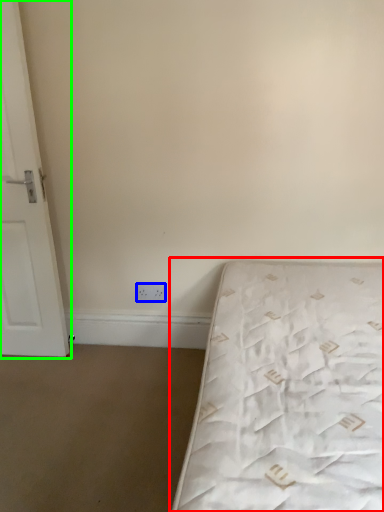
Question: Which is nearer to the bed (highlighted by a red box)? electric outlet (highlighted by a blue box) or door (highlighted by a green box).

Choices:
 (A) electric outlet
 (B) door

Answer: (A)